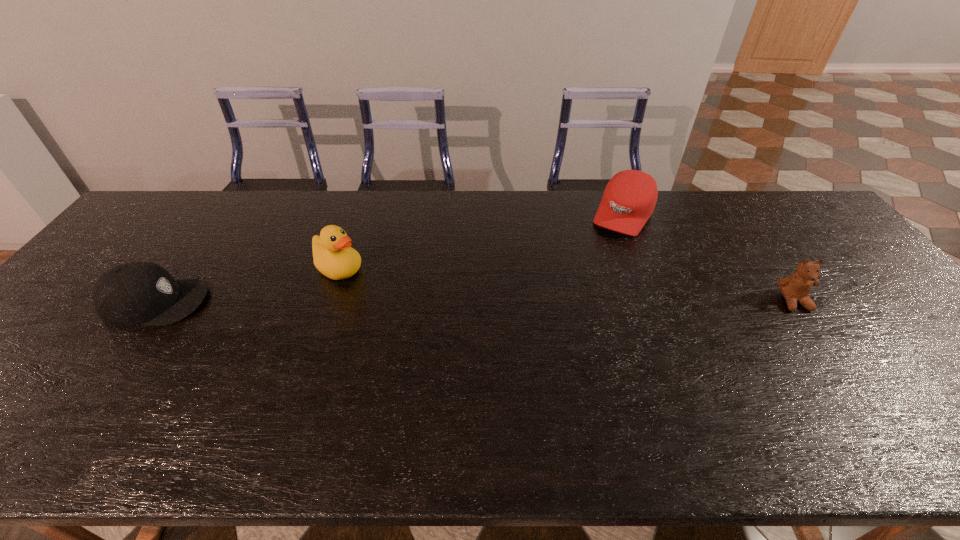
At what (x,y) coordinates should I click in order to perform the action: click on vacant space located at the beak of the tallest object. Please return your answer as a coordinate pair (x, y). Looking at the image, I should click on point(409,305).

Find the location of a particular element. vacant space situated at the beak of the tallest object is located at coordinates (378, 289).

Where is `vacant space situated on the front-facing side of the second object from right to left`? This screenshot has height=540, width=960. vacant space situated on the front-facing side of the second object from right to left is located at coordinates (605, 249).

The width and height of the screenshot is (960, 540). Find the location of `vacant space located 0.400m on the front-facing side of the second object from right to left`. vacant space located 0.400m on the front-facing side of the second object from right to left is located at coordinates (563, 319).

The height and width of the screenshot is (540, 960). Identify the location of blank area located 0.190m on the front-facing side of the second object from right to left. (x=592, y=271).

Find the location of `object situated at the far edge`. object situated at the far edge is located at coordinates (629, 199).

Identify the location of object located at the left edge. This screenshot has height=540, width=960. (140, 293).

You are a GUI agent. You are given a task and a screenshot of the screen. Output one action in this format:
    pyautogui.click(x=<x>, y=<y>)
    Task: Click on the free space at the far edge
    Image resolution: width=960 pixels, height=540 pixels.
    Given the screenshot: What is the action you would take?
    pyautogui.click(x=304, y=199)

Image resolution: width=960 pixels, height=540 pixels. What are the coordinates of `vacant space at the near edge of the desktop` in the screenshot? It's located at (578, 392).

The width and height of the screenshot is (960, 540). Identify the location of free space at the right edge of the desktop. coord(955,373).